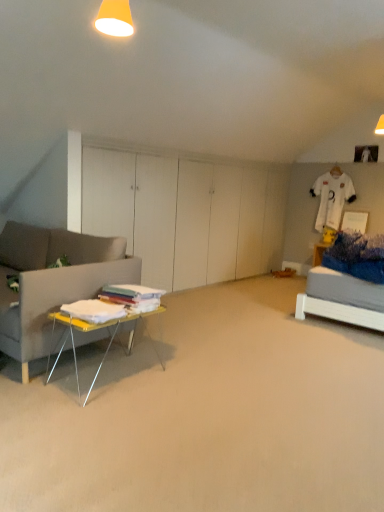
Question: From the image's perspective, is yellow matte lampshade at upper center over yellow metallic table at lower left?

Choices:
 (A) no
 (B) yes

Answer: (B)

Question: Does yellow matte lampshade at upper center turn towards yellow metallic table at lower left?

Choices:
 (A) yes
 (B) no

Answer: (B)

Question: From a real-world perspective, does yellow matte lampshade at upper center stand above yellow metallic table at lower left?

Choices:
 (A) yes
 (B) no

Answer: (A)

Question: Does yellow matte lampshade at upper center lie behind yellow metallic table at lower left?

Choices:
 (A) yes
 (B) no

Answer: (B)

Question: From a real-world perspective, is yellow matte lampshade at upper center positioned under yellow metallic table at lower left based on gravity?

Choices:
 (A) yes
 (B) no

Answer: (B)

Question: Is white fabric at left bigger or smaller than yellow matte lampshade at upper center?

Choices:
 (A) big
 (B) small

Answer: (A)

Question: From the image's perspective, is white fabric at left positioned above or below yellow matte lampshade at upper center?

Choices:
 (A) above
 (B) below

Answer: (B)

Question: Visually, is white fabric at left positioned to the left or to the right of yellow matte lampshade at upper center?

Choices:
 (A) right
 (B) left

Answer: (A)

Question: Looking at their shapes, would you say white fabric at left is wider or thinner than yellow matte lampshade at upper center?

Choices:
 (A) wide
 (B) thin

Answer: (A)

Question: Is white fabric at left situated inside yellow metallic table at lower left or outside?

Choices:
 (A) outside
 (B) inside

Answer: (A)

Question: From a real-world perspective, is white fabric at left physically located above or below yellow metallic table at lower left?

Choices:
 (A) above
 (B) below

Answer: (B)

Question: From the image's perspective, is white fabric at left located above or below yellow metallic table at lower left?

Choices:
 (A) below
 (B) above

Answer: (A)

Question: Based on their sizes in the image, would you say white fabric at left is bigger or smaller than yellow metallic table at lower left?

Choices:
 (A) big
 (B) small

Answer: (A)

Question: Is yellow matte lampshade at upper center spatially inside white fabric at left, or outside of it?

Choices:
 (A) inside
 (B) outside

Answer: (B)

Question: From the image's perspective, is yellow matte lampshade at upper center above or below white fabric at left?

Choices:
 (A) below
 (B) above

Answer: (B)